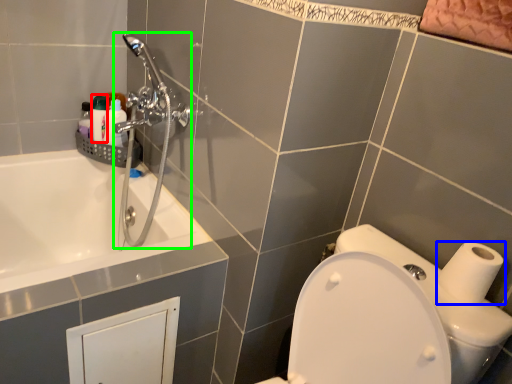
Question: Which object is positioned farthest from toiletry (highlighted by a red box)? Select from toilet paper (highlighted by a blue box) and shower (highlighted by a green box).

Choices:
 (A) toilet paper
 (B) shower

Answer: (A)